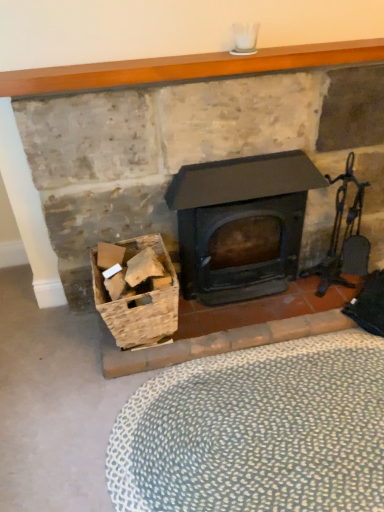
What are the coordinates of `vacant area that lies between wooden crate at lower left and matte black wood burning stove at center` in the screenshot? It's located at (231, 321).